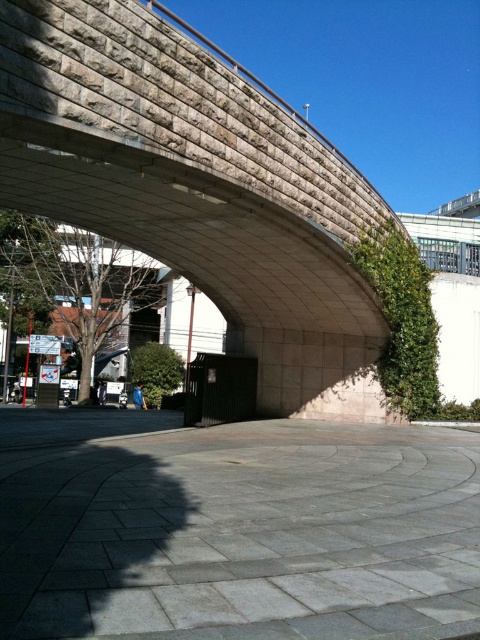
Question: Is gray concrete pavement at center to the right of stone textured bridge at center from the viewer's perspective?

Choices:
 (A) yes
 (B) no

Answer: (A)

Question: Which object appears closest to the camera in this image?

Choices:
 (A) gray concrete pavement at center
 (B) stone textured bridge at center

Answer: (A)

Question: Can you confirm if gray concrete pavement at center is positioned to the right of stone textured bridge at center?

Choices:
 (A) no
 (B) yes

Answer: (B)

Question: Is gray concrete pavement at center to the right of stone textured bridge at center from the viewer's perspective?

Choices:
 (A) no
 (B) yes

Answer: (B)

Question: Which of the following is the farthest from the observer?

Choices:
 (A) gray concrete pavement at center
 (B) stone textured bridge at center

Answer: (B)